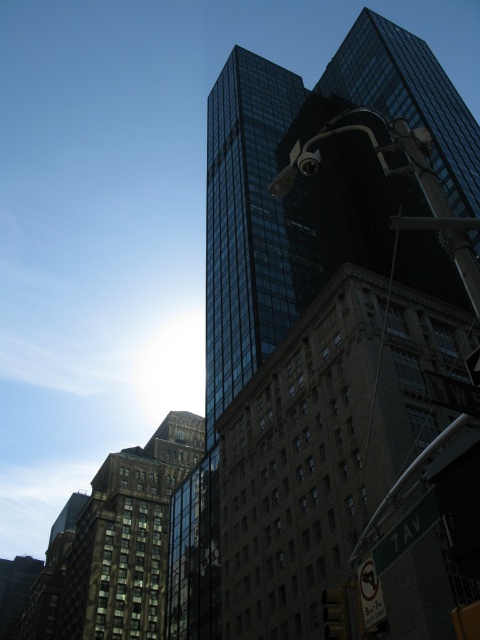
Between point (144, 566) and point (335, 632), which one is positioned in front?

Positioned in front is point (335, 632).

How far apart are brown brick building at center and metallic silver traffic light at lower right?

They are 91.67 meters apart.

Is point (96, 577) closer to camera compared to point (331, 600)?

That is False.

This screenshot has width=480, height=640. In order to click on brown brick building at center in this screenshot , I will do `click(128, 538)`.

Between point (425, 212) and point (336, 596), which one is positioned behind?

Point (425, 212)

Between shiny glass skyscraper at center and metallic silver traffic light at lower right, which one appears on the left side from the viewer's perspective?

metallic silver traffic light at lower right

Describe the element at coordinates (313, 332) in the screenshot. I see `shiny glass skyscraper at center` at that location.

This screenshot has width=480, height=640. I want to click on shiny glass skyscraper at center, so [x=313, y=332].

The height and width of the screenshot is (640, 480). What do you see at coordinates (406, 531) in the screenshot?
I see `green matte street sign at lower right` at bounding box center [406, 531].

Does green matte street sign at lower right lie in front of metallic silver traffic light at lower right?

Yes, it is.

Does point (403, 525) come behind point (324, 602)?

That is False.

Locate an element on the screen. Image resolution: width=480 pixels, height=640 pixels. green matte street sign at lower right is located at coordinates (406, 531).